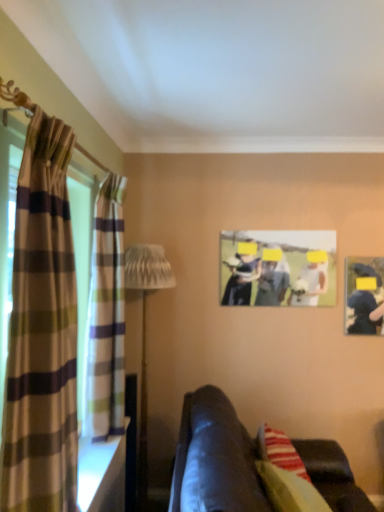
At what (x,y) coordinates should I click in order to perform the action: click on matte plastic picture frame at center. Please return your answer as a coordinate pair (x, y). Image resolution: width=384 pixels, height=512 pixels. Looking at the image, I should click on (278, 268).

Identify the location of plaid fabric curtain at left, the second curtain viewed from the back. (42, 332).

Considering the relative sizes of plaid fabric curtain at left, positioned as the first curtain in back-to-front order, and plaid fabric curtain at left, the second curtain viewed from the back, in the image provided, is plaid fabric curtain at left, positioned as the first curtain in back-to-front order, thinner than plaid fabric curtain at left, the second curtain viewed from the back,?

In fact, plaid fabric curtain at left, positioned as the first curtain in back-to-front order, might be wider than plaid fabric curtain at left, the second curtain viewed from the back.

Between point (118, 389) and point (69, 358), which one is positioned in front?

The point (69, 358) is closer.

Based on the photo, does plaid fabric curtain at left, which is counted as the 2th curtain, starting from the front, have a greater height compared to plaid fabric curtain at left, which appears as the 1th curtain when viewed from the front?

No, plaid fabric curtain at left, which is counted as the 2th curtain, starting from the front, is not taller than plaid fabric curtain at left, which appears as the 1th curtain when viewed from the front.

How different are the orientations of plaid fabric curtain at left, positioned as the first curtain in back-to-front order, and plaid fabric curtain at left, the second curtain viewed from the back, in degrees?

They differ by 2.81 degrees in their facing directions.

Does matte plastic picture frame at center have a lesser height compared to velvet black couch at lower center?

Yes.

Considering the relative positions of matte plastic picture frame at center and velvet black couch at lower center in the image provided, is matte plastic picture frame at center to the left or to the right of velvet black couch at lower center?

From the image, it's evident that matte plastic picture frame at center is to the right of velvet black couch at lower center.

Would you say matte plastic picture frame at center is inside or outside velvet black couch at lower center?

matte plastic picture frame at center is located beyond the bounds of velvet black couch at lower center.

From the picture: From the image's perspective, is matte plastic picture frame at center over velvet black couch at lower center?

Yes, from the image's perspective, matte plastic picture frame at center is above velvet black couch at lower center.

From the picture: Does white textured lamp at left come in front of plaid fabric curtain at left, which appears as the 1th curtain when viewed from the front?

No, white textured lamp at left is behind plaid fabric curtain at left, which appears as the 1th curtain when viewed from the front.

Are white textured lamp at left and plaid fabric curtain at left, which appears as the 1th curtain when viewed from the front, far apart?

That's right, there is a large distance between white textured lamp at left and plaid fabric curtain at left, which appears as the 1th curtain when viewed from the front.

Is white textured lamp at left taller than plaid fabric curtain at left, the second curtain viewed from the back?

Correct, white textured lamp at left is much taller as plaid fabric curtain at left, the second curtain viewed from the back.

From the picture: Is white textured lamp at left wider or thinner than plaid fabric curtain at left, the second curtain viewed from the back?

In the image, white textured lamp at left appears to be wider than plaid fabric curtain at left, the second curtain viewed from the back.

Does matte plastic picture frame at center have a greater width compared to white textured lamp at left?

Incorrect, the width of matte plastic picture frame at center does not surpass that of white textured lamp at left.

From a real-world perspective, which object stands above the other?

matte plastic picture frame at center, from a real-world perspective.

At what (x,y) coordinates should I click in order to perform the action: click on picture frame behind the white textured lamp at left. Please return your answer as a coordinate pair (x, y). This screenshot has height=512, width=384. Looking at the image, I should click on (278, 268).

Which of these two, matte plastic picture frame at center or white textured lamp at left, is smaller?

matte plastic picture frame at center is smaller.

Does plaid fabric curtain at left, which is counted as the 2th curtain, starting from the front, appear on the right side of velvet black couch at lower center?

No.

Is plaid fabric curtain at left, positioned as the first curtain in back-to-front order, shorter than velvet black couch at lower center?

No.

How different are the orientations of plaid fabric curtain at left, positioned as the first curtain in back-to-front order, and velvet black couch at lower center in degrees?

There is a 0.734-degree angle between the facing directions of plaid fabric curtain at left, positioned as the first curtain in back-to-front order, and velvet black couch at lower center.

Is plaid fabric curtain at left, which is counted as the 2th curtain, starting from the front, thinner than velvet black couch at lower center?

Yes, plaid fabric curtain at left, which is counted as the 2th curtain, starting from the front, is thinner than velvet black couch at lower center.

This screenshot has height=512, width=384. I want to click on the 2nd curtain to the left of the matte plastic picture frame at center, counting from the anchor's position, so click(42, 332).

From a real-world perspective, is plaid fabric curtain at left, the second curtain viewed from the back, located beneath matte plastic picture frame at center?

Yes, from a real-world perspective, plaid fabric curtain at left, the second curtain viewed from the back, is under matte plastic picture frame at center.

Considering the points (21, 248) and (274, 231), which point is behind, point (21, 248) or point (274, 231)?

The point (274, 231) is more distant.

Can you confirm if plaid fabric curtain at left, the second curtain viewed from the back, is taller than matte plastic picture frame at center?

Yes.

From a real-world perspective, which is physically below, velvet black couch at lower center or matte plastic picture frame at center?

In real-world perspective, velvet black couch at lower center is lower.

Can you confirm if velvet black couch at lower center is shorter than matte plastic picture frame at center?

Incorrect, the height of velvet black couch at lower center does not fall short of that of matte plastic picture frame at center.

From the image's perspective, relative to matte plastic picture frame at center, is velvet black couch at lower center above or below?

velvet black couch at lower center is below matte plastic picture frame at center.

At what (x,y) coordinates should I click in order to perform the action: click on studio couch on the left of matte plastic picture frame at center. Please return your answer as a coordinate pair (x, y). This screenshot has width=384, height=512. Looking at the image, I should click on (215, 459).

Where is `curtain that appears on the right of plaid fabric curtain at left, which appears as the 1th curtain when viewed from the front`? The image size is (384, 512). curtain that appears on the right of plaid fabric curtain at left, which appears as the 1th curtain when viewed from the front is located at coordinates (106, 317).

Locate an element on the screen. picture frame positioned vertically above the velvet black couch at lower center (from a real-world perspective) is located at coordinates (278, 268).

Which object lies further to the anchor point plaid fabric curtain at left, positioned as the first curtain in back-to-front order, velvet black couch at lower center or plaid fabric curtain at left, the second curtain viewed from the back?

velvet black couch at lower center is further to plaid fabric curtain at left, positioned as the first curtain in back-to-front order.

Considering their positions, is velvet black couch at lower center positioned closer to white textured lamp at left than plaid fabric curtain at left, positioned as the first curtain in back-to-front order?

plaid fabric curtain at left, positioned as the first curtain in back-to-front order, is positioned closer to the anchor white textured lamp at left.

When comparing their distances from matte plastic picture frame at center, does white textured lamp at left or plaid fabric curtain at left, the second curtain viewed from the back, seem closer?

The object closer to matte plastic picture frame at center is white textured lamp at left.

From the picture: Looking at the image, which one is located further to white textured lamp at left, plaid fabric curtain at left, which appears as the 1th curtain when viewed from the front, or velvet black couch at lower center?

plaid fabric curtain at left, which appears as the 1th curtain when viewed from the front.

From the image, which object appears to be farther from plaid fabric curtain at left, the second curtain viewed from the back, velvet black couch at lower center or matte plastic picture frame at center?

Among the two, matte plastic picture frame at center is located further to plaid fabric curtain at left, the second curtain viewed from the back.

Based on their spatial positions, is plaid fabric curtain at left, positioned as the first curtain in back-to-front order, or matte plastic picture frame at center further from velvet black couch at lower center?

Based on the image, matte plastic picture frame at center appears to be further to velvet black couch at lower center.

Estimate the real-world distances between objects in this image. Which object is closer to plaid fabric curtain at left, positioned as the first curtain in back-to-front order, velvet black couch at lower center or white textured lamp at left?

velvet black couch at lower center lies closer to plaid fabric curtain at left, positioned as the first curtain in back-to-front order, than the other object.

In the scene shown: Based on their spatial positions, is plaid fabric curtain at left, the second curtain viewed from the back, or white textured lamp at left closer to velvet black couch at lower center?

Among the two, plaid fabric curtain at left, the second curtain viewed from the back, is located nearer to velvet black couch at lower center.

Locate an element on the screen. studio couch located between plaid fabric curtain at left, which appears as the 1th curtain when viewed from the front, and matte plastic picture frame at center in the depth direction is located at coordinates (215, 459).

The height and width of the screenshot is (512, 384). In order to click on studio couch between plaid fabric curtain at left, the second curtain viewed from the back, and white textured lamp at left in the front-back direction in this screenshot , I will do `click(215, 459)`.

This screenshot has height=512, width=384. In order to click on curtain positioned between velvet black couch at lower center and matte plastic picture frame at center from near to far in this screenshot , I will do `click(106, 317)`.

The width and height of the screenshot is (384, 512). Identify the location of curtain positioned between velvet black couch at lower center and white textured lamp at left from near to far. (106, 317).